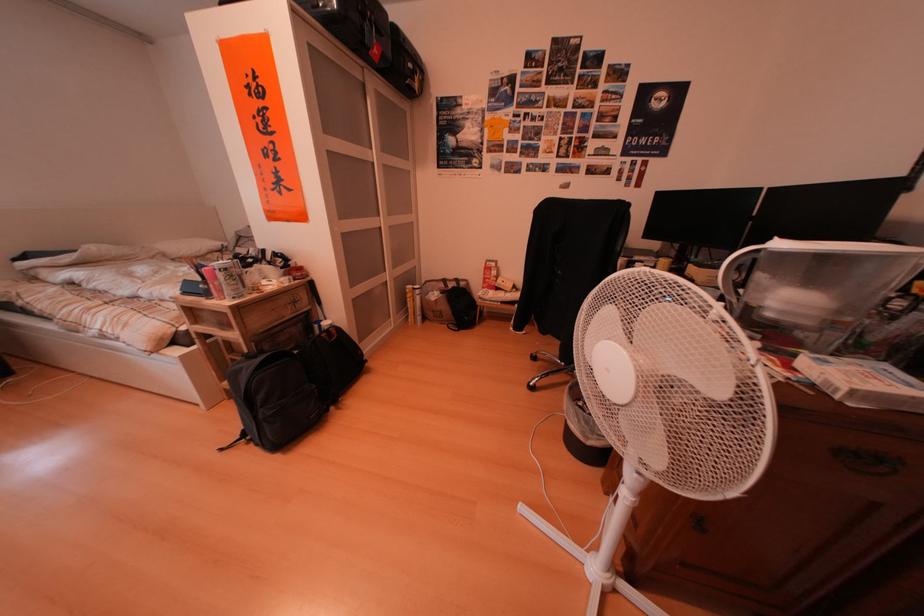
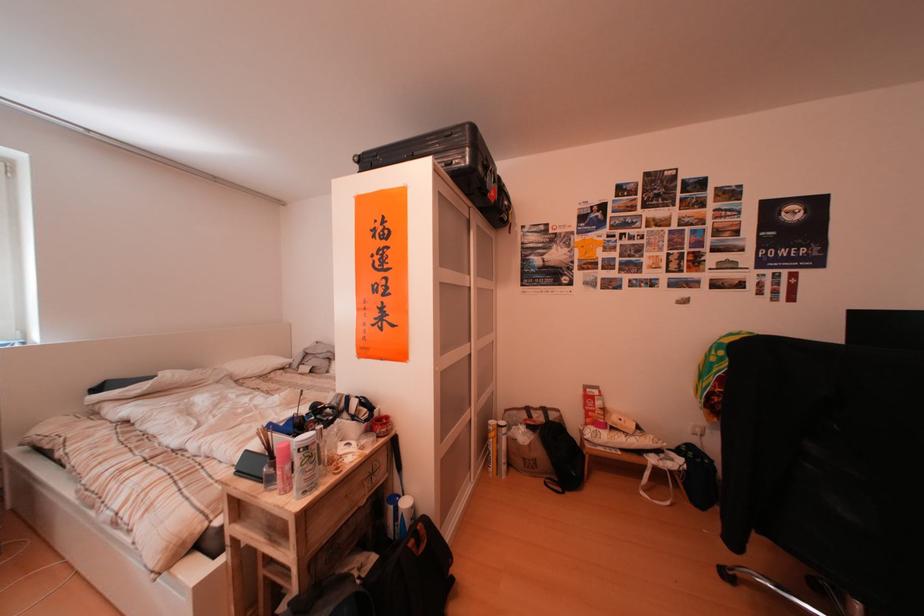
Question: I am providing you with two images of the same scene from different viewpoints. After the viewpoint changes to image2, which objects are now occluded?

Choices:
 (A) red lidded jar
 (B) blue and white bottle
 (C) brown paper bag
 (D) none of these

Answer: (D)